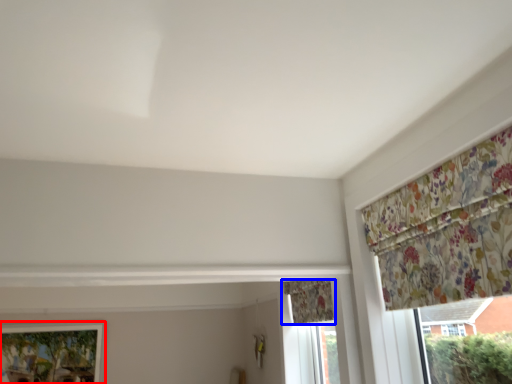
Question: Which of the following is the closest to the observer, window (highlighted by a red box) or curtain (highlighted by a blue box)?

Choices:
 (A) window
 (B) curtain

Answer: (B)